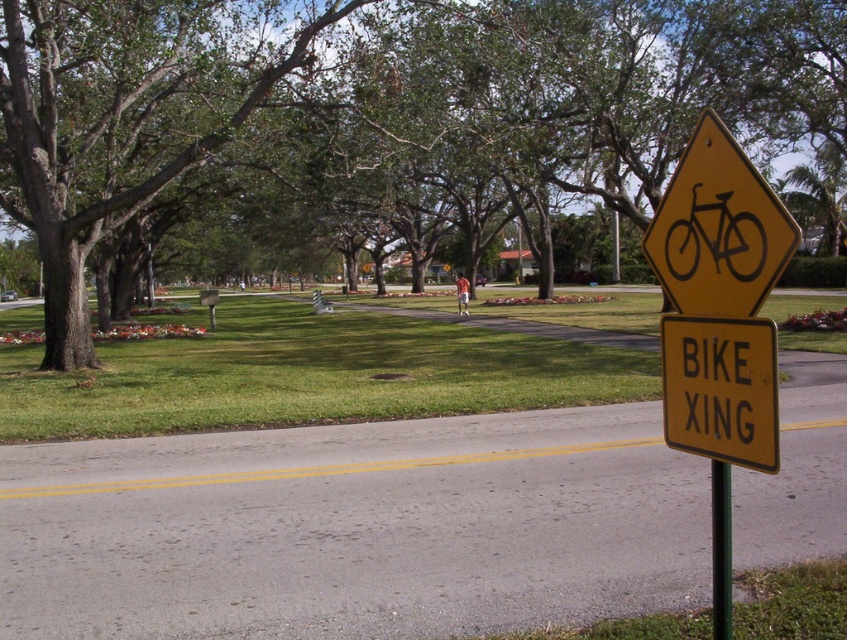
In the scene shown: How much distance is there between yellow diamond-shaped bike sign at right and yellow/black/traffic sign at right?

yellow diamond-shaped bike sign at right and yellow/black/traffic sign at right are 21.75 inches apart from each other.

Can you confirm if yellow diamond-shaped bike sign at right is wider than yellow/black/traffic sign at right?

Yes.

Measure the distance between yellow diamond-shaped bike sign at right and camera.

yellow diamond-shaped bike sign at right and camera are 7.90 feet apart from each other.

Locate an element on the screen. yellow diamond-shaped bike sign at right is located at coordinates (718, 228).

In the scene shown: Which is more to the right, green leafy tree at center or yellow diamond-shaped bike sign at right?

Positioned to the right is green leafy tree at center.

Does green leafy tree at center have a smaller size compared to yellow diamond-shaped bike sign at right?

No, green leafy tree at center is not smaller than yellow diamond-shaped bike sign at right.

Is point (618, 131) farther from camera compared to point (684, 208)?

Yes, it is behind point (684, 208).

You are a GUI agent. You are given a task and a screenshot of the screen. Output one action in this format:
    pyautogui.click(x=<x>, y=<y>)
    Task: Click on the green leafy tree at center
    
    Given the screenshot: What is the action you would take?
    pyautogui.click(x=374, y=124)

Can you confirm if yellow diamond-shaped bike sign at right is smaller than yellow/yellowish metal/yellow metal sign at right?

Incorrect, yellow diamond-shaped bike sign at right is not smaller in size than yellow/yellowish metal/yellow metal sign at right.

Is yellow diamond-shaped bike sign at right further to the viewer compared to yellow/yellowish metal/yellow metal sign at right?

No, yellow diamond-shaped bike sign at right is closer to the viewer.

At what (x,y) coordinates should I click in order to perform the action: click on yellow diamond-shaped bike sign at right. Please return your answer as a coordinate pair (x, y). Looking at the image, I should click on (718, 228).

This screenshot has height=640, width=847. Find the location of `yellow diamond-shaped bike sign at right`. yellow diamond-shaped bike sign at right is located at coordinates (718, 228).